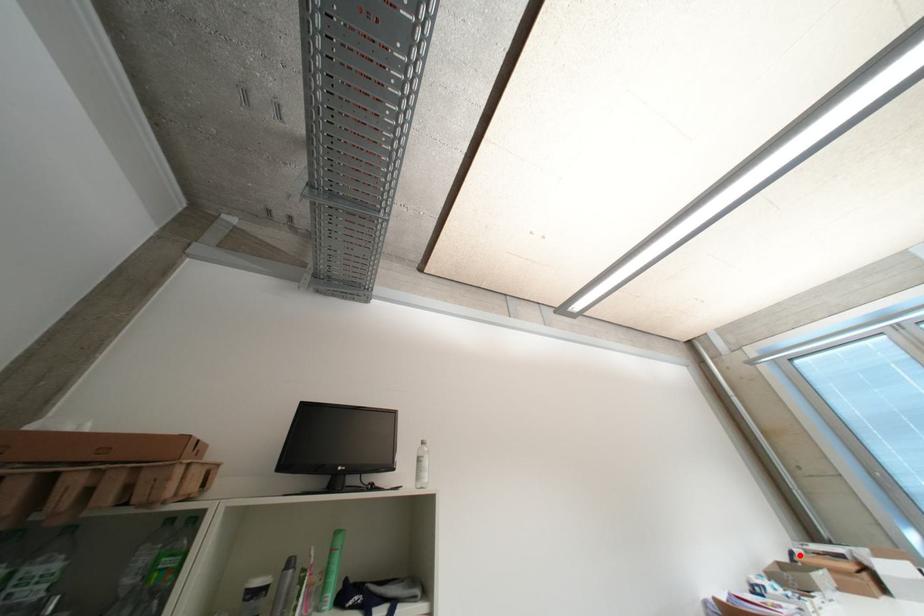
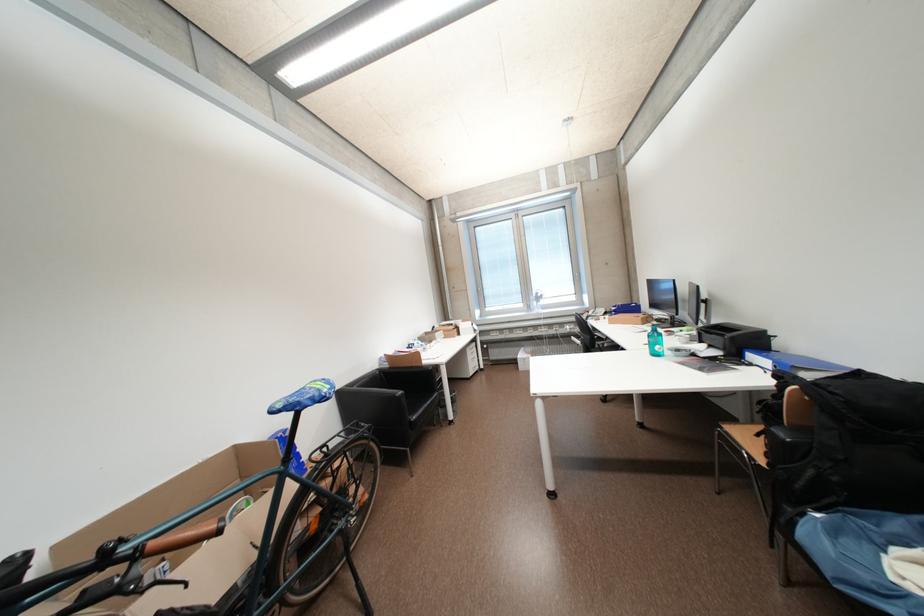
Question: I am providing you with two images of the same scene from different viewpoints. A red point is shown in image1. For the corresponding object point in image2, is it positioned nearer or farther from the camera?

Choices:
 (A) Nearer
 (B) Farther

Answer: (B)